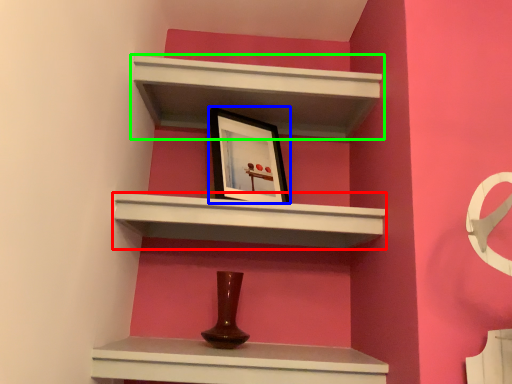
Question: Which object is the closest to the shelf (highlighted by a red box)? Choose among these: picture frame (highlighted by a blue box) or shelf (highlighted by a green box).

Choices:
 (A) picture frame
 (B) shelf

Answer: (A)